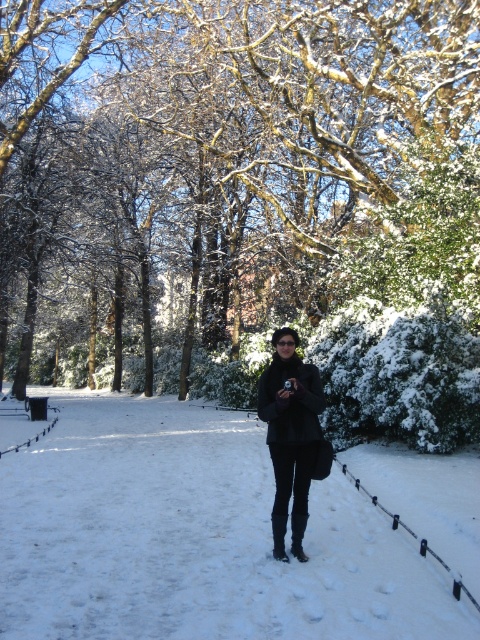
Question: Considering the real-world distances, which object is closest to the white fluffy snow at center?

Choices:
 (A) black matte coat at center
 (B) snow-covered branches at center

Answer: (A)

Question: Based on their relative distances, which object is farther from the black matte coat at center?

Choices:
 (A) snow-covered branches at center
 (B) white fluffy snow at center

Answer: (A)

Question: Which object is the closest to the white fluffy snow at center?

Choices:
 (A) snow-covered branches at center
 (B) black matte coat at center

Answer: (B)

Question: Considering the relative positions of white fluffy snow at center and black matte coat at center in the image provided, where is white fluffy snow at center located with respect to black matte coat at center?

Choices:
 (A) above
 (B) below

Answer: (B)

Question: Is white fluffy snow at center positioned at the back of black matte coat at center?

Choices:
 (A) no
 (B) yes

Answer: (A)

Question: Can you confirm if snow-covered branches at center is positioned above black matte coat at center?

Choices:
 (A) no
 (B) yes

Answer: (B)